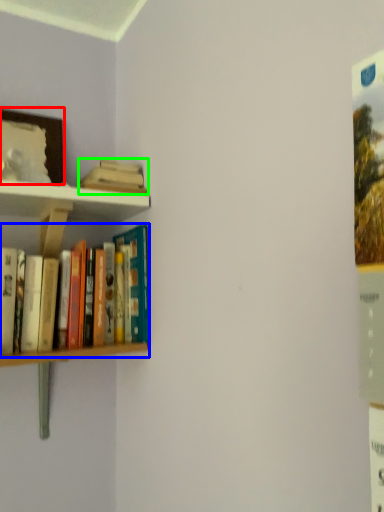
Question: Which is farther away from picture frame (highlighted by a red box)? book (highlighted by a blue box) or book (highlighted by a green box)?

Choices:
 (A) book
 (B) book

Answer: (A)